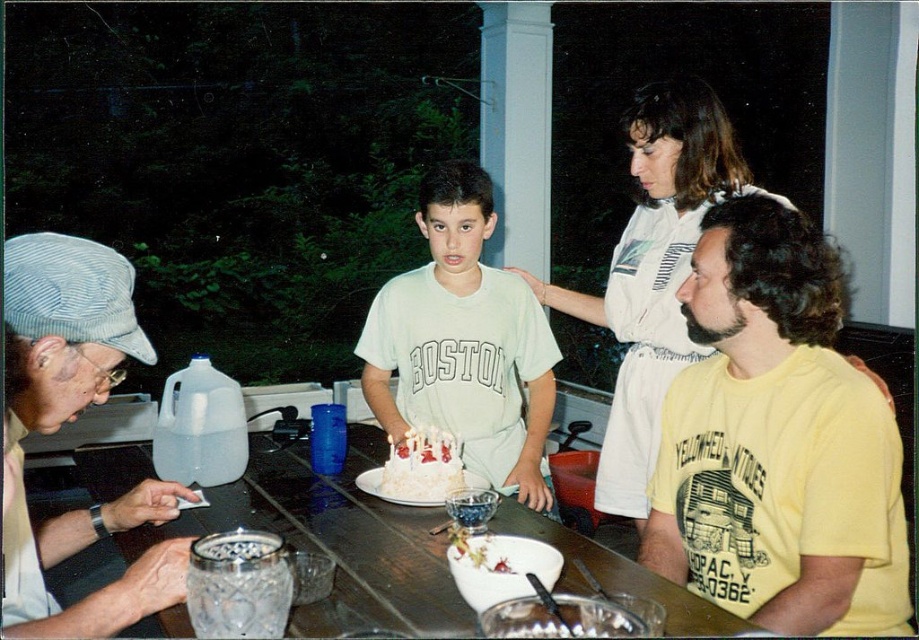
Question: Is yellow cotton t-shirt at lower right below khaki fabric cap at left?

Choices:
 (A) no
 (B) yes

Answer: (A)

Question: Which object is farther from the camera taking this photo?

Choices:
 (A) yellow cotton t-shirt at lower right
 (B) white frosted cake at center
 (C) khaki fabric cap at left

Answer: (B)

Question: Which of the following is the closest to the observer?

Choices:
 (A) khaki fabric cap at left
 (B) yellow cotton t-shirt at lower right
 (C) white cotton shirt at upper center
 (D) wooden table at center

Answer: (A)

Question: Can you confirm if khaki fabric cap at left is positioned below white cotton shirt at upper center?

Choices:
 (A) yes
 (B) no

Answer: (A)

Question: Does white cotton shirt at center come in front of white frosted cake at center?

Choices:
 (A) no
 (B) yes

Answer: (A)

Question: Which object is closer to the camera taking this photo?

Choices:
 (A) wooden table at center
 (B) white cotton shirt at center
 (C) khaki fabric cap at left
 (D) white frosted cake at center

Answer: (C)